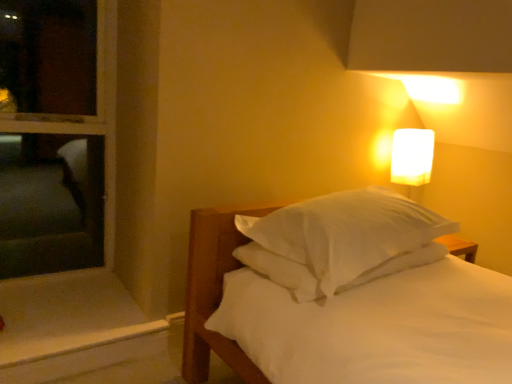
Where is `free spot above white wood window sill at lower left (from a real-world perspective)`? free spot above white wood window sill at lower left (from a real-world perspective) is located at coordinates 76,311.